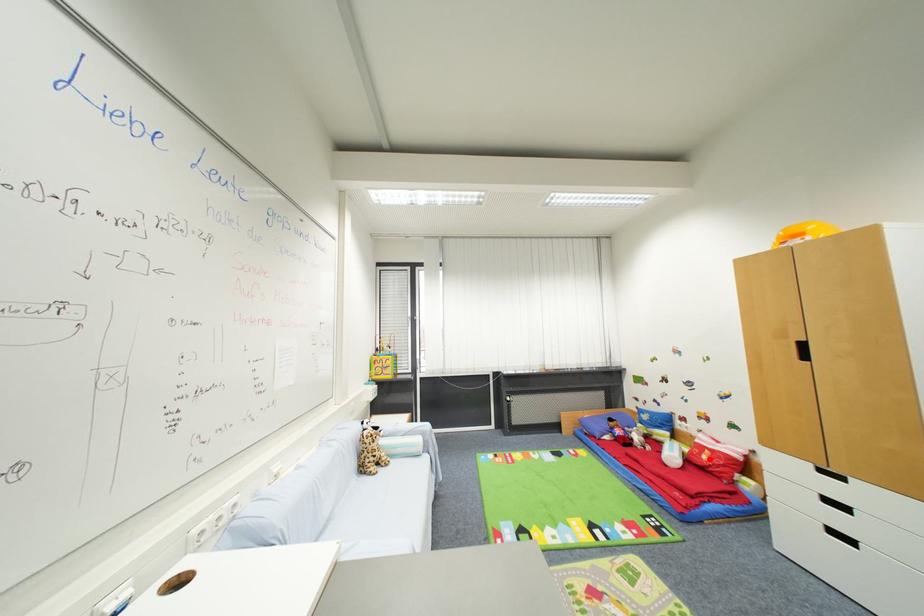
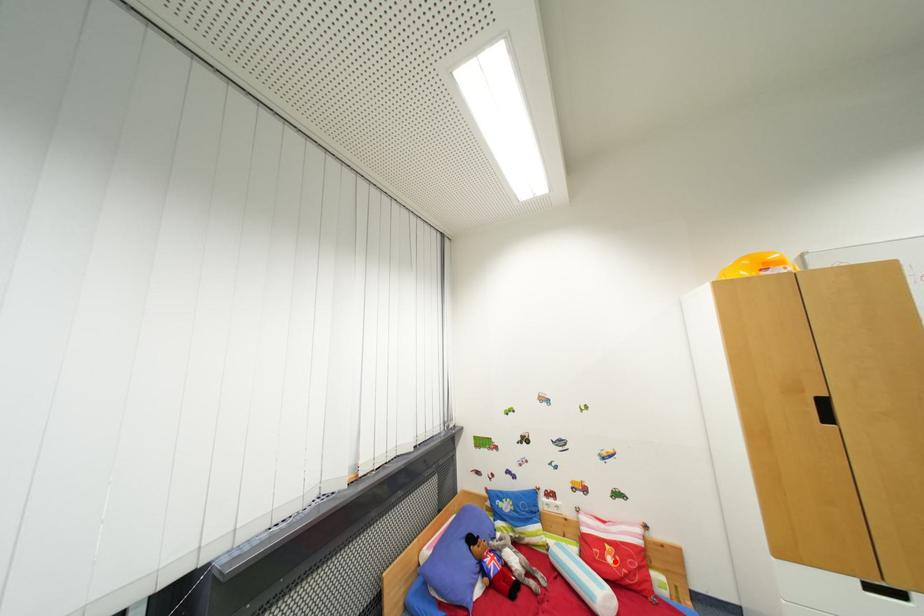
I am providing you with two images of the same scene from different viewpoints. A red point is marked on the first image and another point is marked on the second image. Is the red point in image1 aligned with the point shown in image2?

Yes